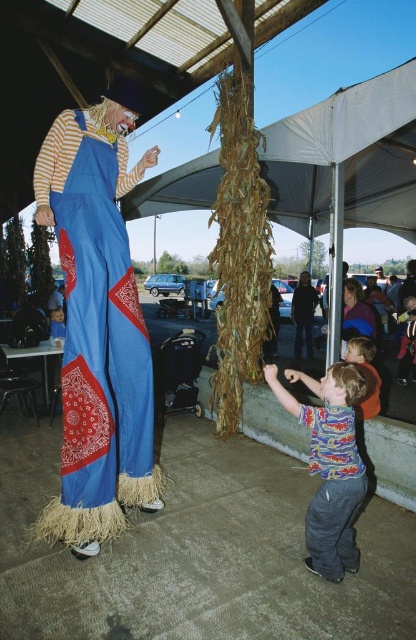
Does blue straw scarecrow at left have a lesser height compared to printed cotton shirt at lower right?

Incorrect, blue straw scarecrow at left's height does not fall short of printed cotton shirt at lower right's.

Image resolution: width=416 pixels, height=640 pixels. Describe the element at coordinates (98, 324) in the screenshot. I see `blue straw scarecrow at left` at that location.

Where is `blue straw scarecrow at left`? The image size is (416, 640). blue straw scarecrow at left is located at coordinates (98, 324).

In the scene shown: Who is higher up, printed cotton shirt at lower right or matte blue shirt at center?

matte blue shirt at center

This screenshot has width=416, height=640. Describe the element at coordinates (329, 465) in the screenshot. I see `printed cotton shirt at lower right` at that location.

Identify the location of printed cotton shirt at lower right. (329, 465).

Can you confirm if blue straw scarecrow at left is thinner than matte blue shirt at center?

No.

Which is more to the left, blue straw scarecrow at left or matte blue shirt at center?

blue straw scarecrow at left

Is point (136, 301) closer to camera compared to point (403, 358)?

Yes, it is in front of point (403, 358).

I want to click on blue straw scarecrow at left, so click(98, 324).